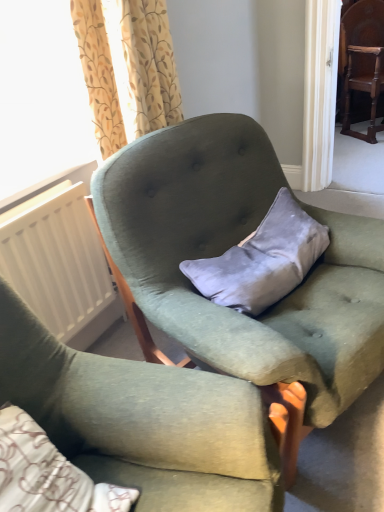
Question: Should I look upward or downward to see velvet green armchair at center, marked as the 2th chair in a top-to-bottom arrangement?

Choices:
 (A) down
 (B) up

Answer: (A)

Question: Is velvet green armchair at center, the 2th chair when ordered from bottom to top, aimed at velvet gray pillow at center?

Choices:
 (A) yes
 (B) no

Answer: (A)

Question: Are velvet green armchair at center, placed as the second chair when sorted from front to back, and velvet gray pillow at center located far from each other?

Choices:
 (A) yes
 (B) no

Answer: (B)

Question: Does velvet green armchair at center, which ranks as the 2th chair in left-to-right order, have a greater height compared to velvet gray pillow at center?

Choices:
 (A) yes
 (B) no

Answer: (A)

Question: Is velvet green armchair at center, which ranks as the 2th chair in left-to-right order, smaller than velvet gray pillow at center?

Choices:
 (A) yes
 (B) no

Answer: (B)

Question: Considering the relative sizes of velvet green armchair at center, marked as the 2th chair in a top-to-bottom arrangement, and velvet gray pillow at center in the image provided, is velvet green armchair at center, marked as the 2th chair in a top-to-bottom arrangement, bigger than velvet gray pillow at center?

Choices:
 (A) no
 (B) yes

Answer: (B)

Question: From a real-world perspective, does velvet green armchair at center, the 2th chair when ordered from bottom to top, sit lower than velvet gray pillow at center?

Choices:
 (A) yes
 (B) no

Answer: (A)

Question: Is dark brown wood chair at upper right, the 1th chair from the top, to the left of velvet green armchair at center, the 1th chair when ordered from left to right, from the viewer's perspective?

Choices:
 (A) no
 (B) yes

Answer: (A)

Question: Is dark brown wood chair at upper right, which is the third chair from left to right, at the right side of velvet green armchair at center, the 1th chair when ordered from left to right?

Choices:
 (A) yes
 (B) no

Answer: (A)

Question: Can you confirm if dark brown wood chair at upper right, which is the third chair in bottom-to-top order, is thinner than velvet green armchair at center, acting as the 3th chair starting from the top?

Choices:
 (A) no
 (B) yes

Answer: (B)

Question: From a real-world perspective, is dark brown wood chair at upper right, the third chair in the front-to-back sequence, beneath velvet green armchair at center, the 1th chair when ordered from left to right?

Choices:
 (A) yes
 (B) no

Answer: (B)

Question: Does dark brown wood chair at upper right, which is the third chair from left to right, come in front of velvet green armchair at center, the first chair positioned from the bottom?

Choices:
 (A) no
 (B) yes

Answer: (A)

Question: Would you consider dark brown wood chair at upper right, the third chair in the front-to-back sequence, to be distant from velvet green armchair at center, placed as the 3th chair when sorted from back to front?

Choices:
 (A) yes
 (B) no

Answer: (A)

Question: From the image's perspective, is velvet gray pillow at center above dark brown wood chair at upper right, which appears as the first chair when viewed from the back?

Choices:
 (A) yes
 (B) no

Answer: (B)